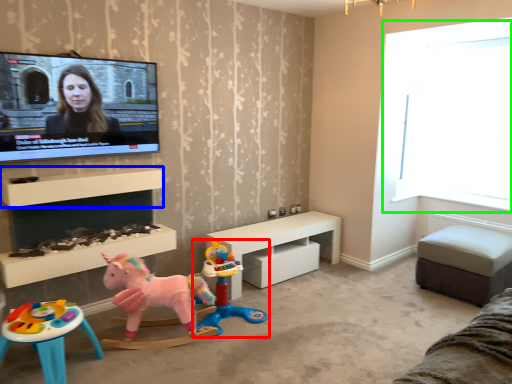
Question: Estimate the real-world distances between objects in this image. Which object is farther from toy (highlighted by a red box), shelf (highlighted by a blue box) or window screen (highlighted by a green box)?

Choices:
 (A) shelf
 (B) window screen

Answer: (B)